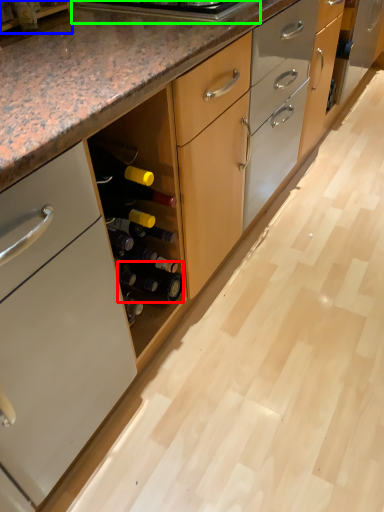
Question: Which object is positioned closest to beer bottle (highlighted by a red box)? Select from shelf (highlighted by a blue box) and appliance (highlighted by a green box).

Choices:
 (A) shelf
 (B) appliance

Answer: (B)